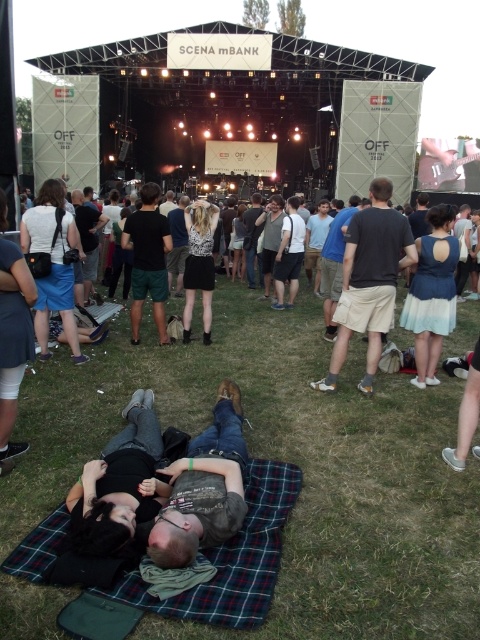
You are a photographer at the concert and need to capture a closeup shot of the blue satin dress at center and the black cotton shorts at center. Which clothing item will require you to zoom in more to fill the frame?

The blue satin dress at center is smaller than the black cotton shorts at center, so you will need to zoom in more to capture the blue satin dress at center to fill the frame.

You are attending the concert and want to take a photo of both the dark blue jeans at lower center and the glittery silver dress at center. Which one should you focus on first to ensure both are in the frame?

You should focus on the glittery silver dress at center first because the dark blue jeans at lower center is positioned on the right side of it, so centering the glittery silver dress will include both in the frame.

You are a photographer at the concert and want to capture both the dark blue jeans at lower center and the glittery silver dress at center in a single shot. Based on their positions, which one is more likely to be fully visible in the frame?

The dark blue jeans at lower center is wider than the glittery silver dress at center, so the glittery silver dress at center is more likely to be fully visible in the frame since it is narrower.